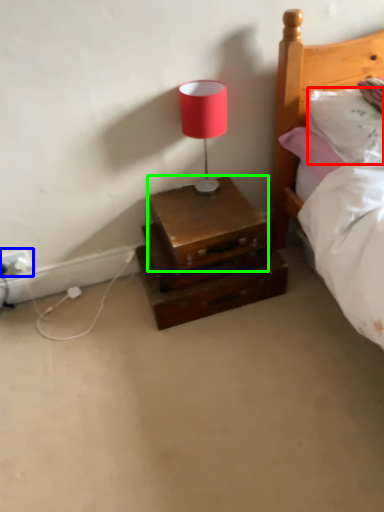
Question: Which is farther away from pillow (highlighted by a red box)? electric outlet (highlighted by a blue box) or chest (highlighted by a green box)?

Choices:
 (A) electric outlet
 (B) chest

Answer: (A)